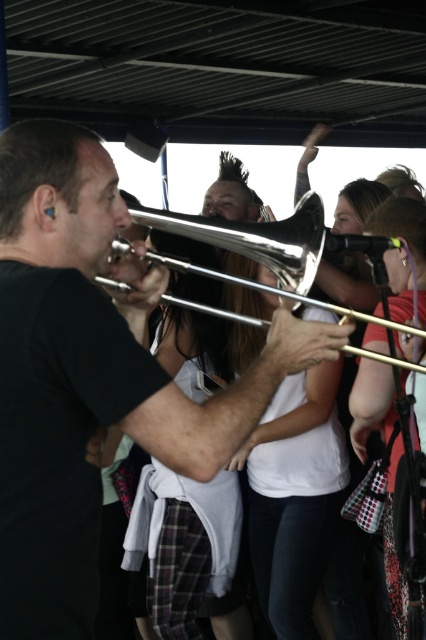
Can you confirm if shiny silver trombone at center is shorter than shiny silver trumpet at center?

In fact, shiny silver trombone at center may be taller than shiny silver trumpet at center.

Is shiny silver trombone at center in front of shiny silver trumpet at center?

That is True.

At what (x,y) coordinates should I click in order to perform the action: click on shiny silver trombone at center. Please return your answer as a coordinate pair (x, y). Image resolution: width=426 pixels, height=640 pixels. Looking at the image, I should click on [x=92, y=372].